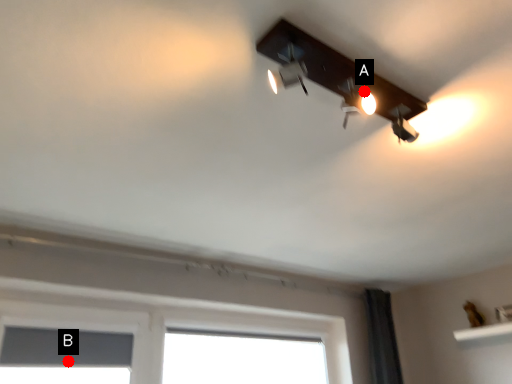
Question: Two points are circled on the image, labeled by A and B beside each circle. Which point is closer to the camera?

Choices:
 (A) A is closer
 (B) B is closer

Answer: (A)